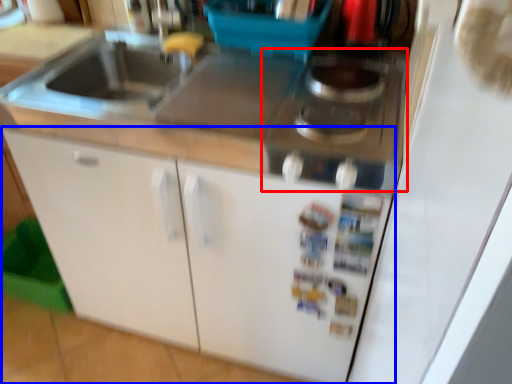
Question: Which object appears closest to the camera in this image, gas stove (highlighted by a red box) or cabinetry (highlighted by a blue box)?

Choices:
 (A) gas stove
 (B) cabinetry

Answer: (A)